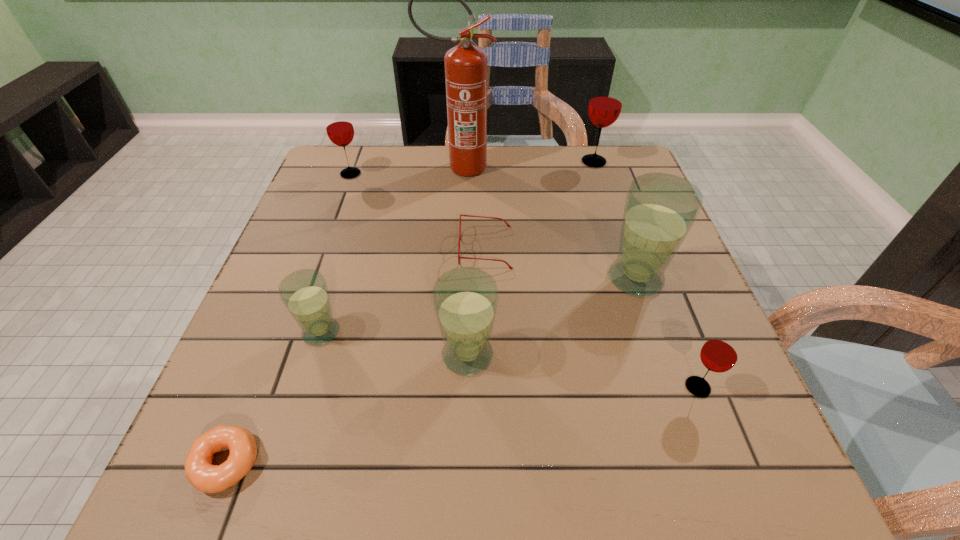
The width and height of the screenshot is (960, 540). What are the coordinates of `spectacles` in the screenshot? It's located at (508, 225).

The width and height of the screenshot is (960, 540). In order to click on red spectacles in this screenshot , I will do `click(508, 225)`.

You are a GUI agent. You are given a task and a screenshot of the screen. Output one action in this format:
    pyautogui.click(x=<x>, y=<y>)
    Task: Click on the nearest object
    Image resolution: width=960 pixels, height=540 pixels.
    Given the screenshot: What is the action you would take?
    pyautogui.click(x=207, y=478)

Identify the location of the shortest object. (207, 478).

This screenshot has width=960, height=540. What are the coordinates of `vacant region located from the nozzle of the fire extinguisher` in the screenshot? It's located at (585, 167).

This screenshot has height=540, width=960. In order to click on free space located on the left of the biggest red glass in this screenshot , I will do `click(485, 162)`.

Image resolution: width=960 pixels, height=540 pixels. Find the location of `vacant space positioned 0.340m on the front of the farthest blue glass`. vacant space positioned 0.340m on the front of the farthest blue glass is located at coordinates (701, 471).

Find the location of a particular element. The height and width of the screenshot is (540, 960). vacant position located on the front of the leftmost red glass is located at coordinates (318, 262).

I want to click on vacant space located 0.180m on the front of the second blue glass from right to left, so tap(465, 488).

Image resolution: width=960 pixels, height=540 pixels. What are the coordinates of `free space located 0.060m on the right of the smallest blue glass` in the screenshot? It's located at (372, 332).